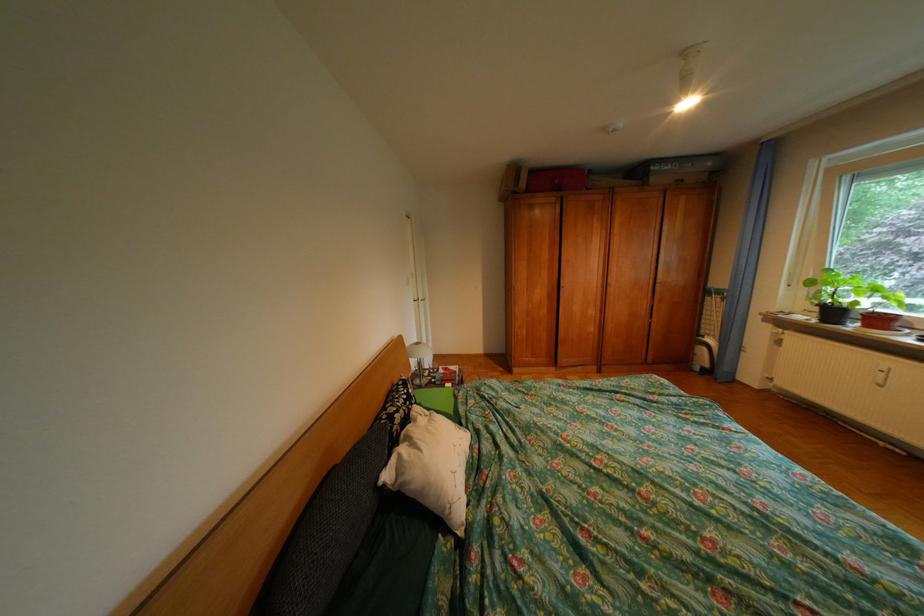
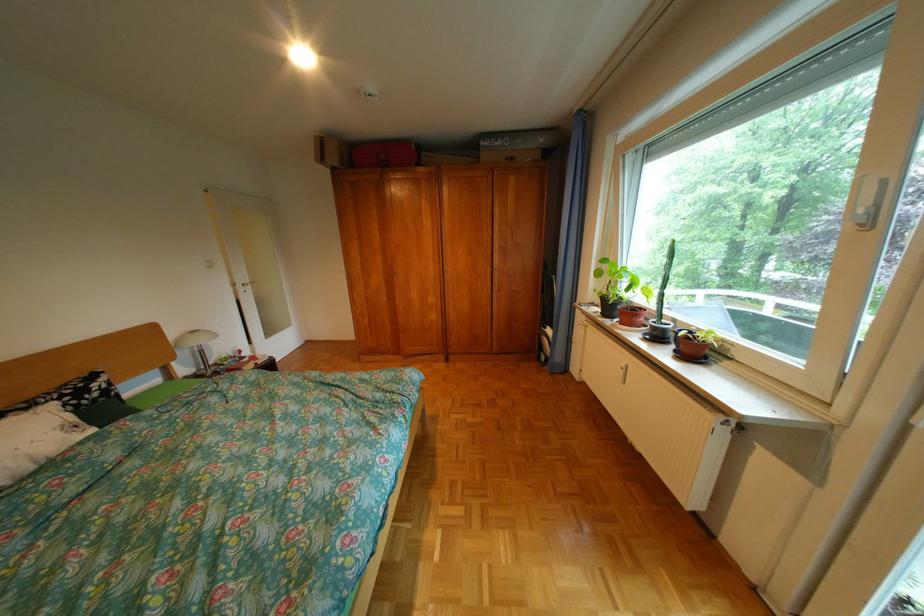
The point at (666, 169) is marked in the first image. Where is the corresponding point in the second image?

(497, 145)